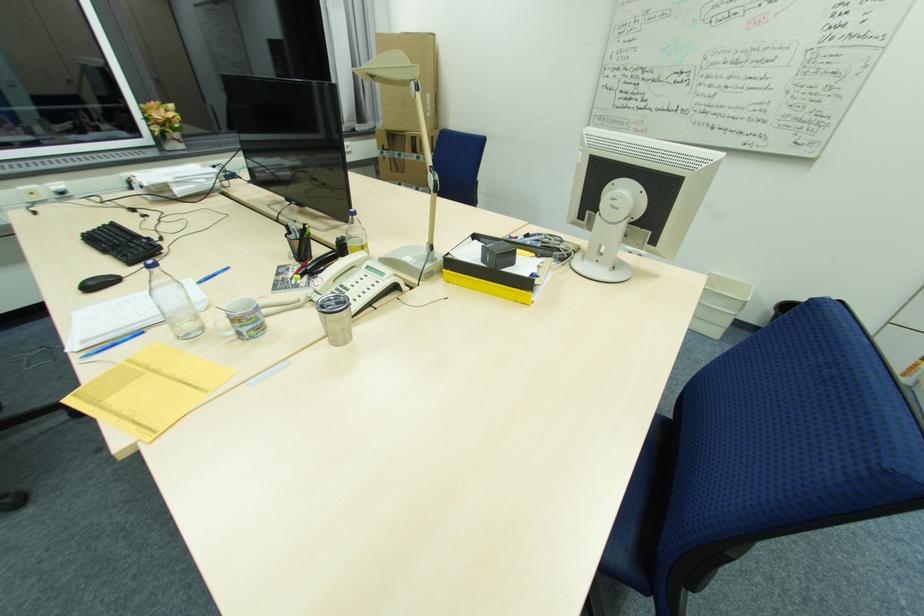
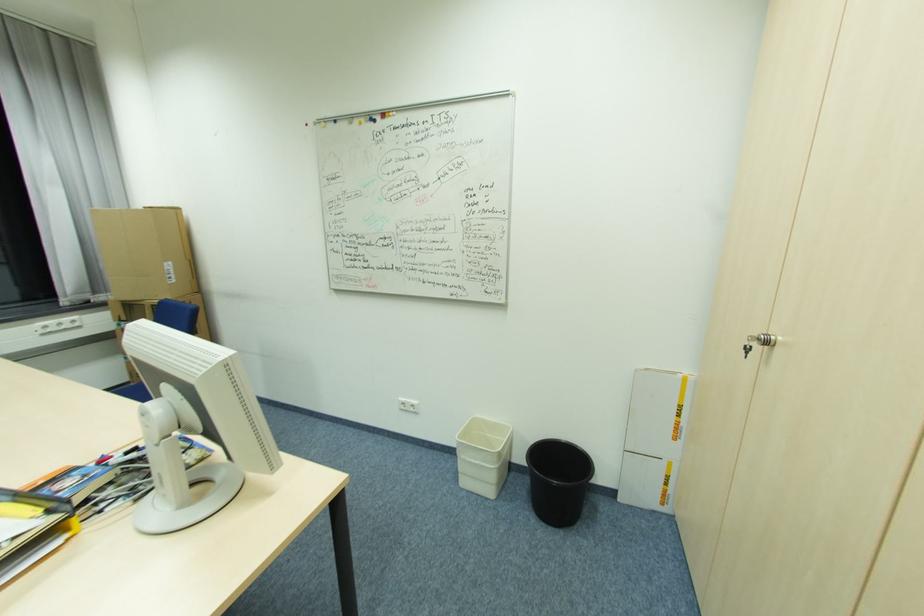
Locate, in the second image, the point that corresponds to pixel 709 164 in the first image.

(207, 371)